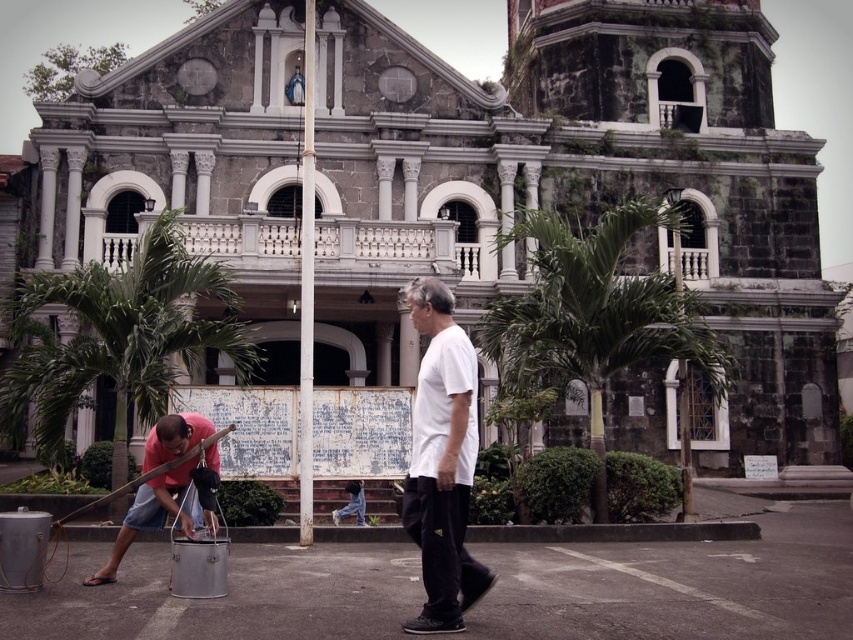
Question: Observing the image, what is the correct spatial positioning of white matte shirt at center in reference to brushed metal bucket at lower left?

Choices:
 (A) above
 (B) below

Answer: (A)

Question: Is white matte shirt at center below brushed metal bucket at lower left?

Choices:
 (A) no
 (B) yes

Answer: (A)

Question: Which object is closer to the camera taking this photo?

Choices:
 (A) white matte shirt at center
 (B) brushed metal bucket at lower left

Answer: (A)

Question: Can you confirm if white matte shirt at center is positioned to the left of brushed metal bucket at lower left?

Choices:
 (A) yes
 (B) no

Answer: (B)